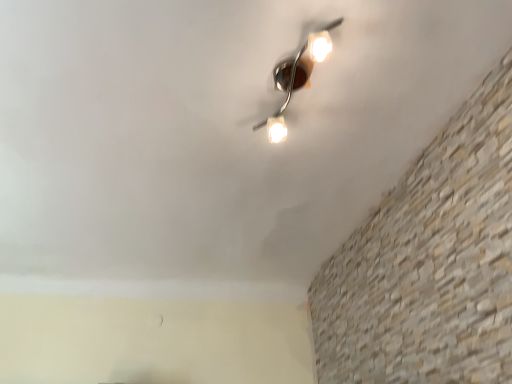
Where is `metallic silver lamp at upper center`? metallic silver lamp at upper center is located at coordinates (297, 74).

Image resolution: width=512 pixels, height=384 pixels. Describe the element at coordinates (297, 74) in the screenshot. I see `metallic silver lamp at upper center` at that location.

Find the location of `metallic silver lamp at upper center`. metallic silver lamp at upper center is located at coordinates (297, 74).